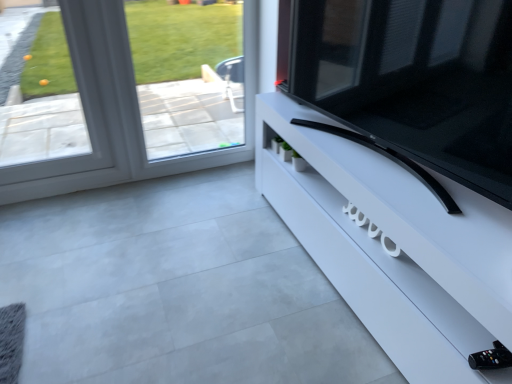
This screenshot has height=384, width=512. I want to click on free spot below black glossy tv at right (from a real-world perspective), so click(x=385, y=156).